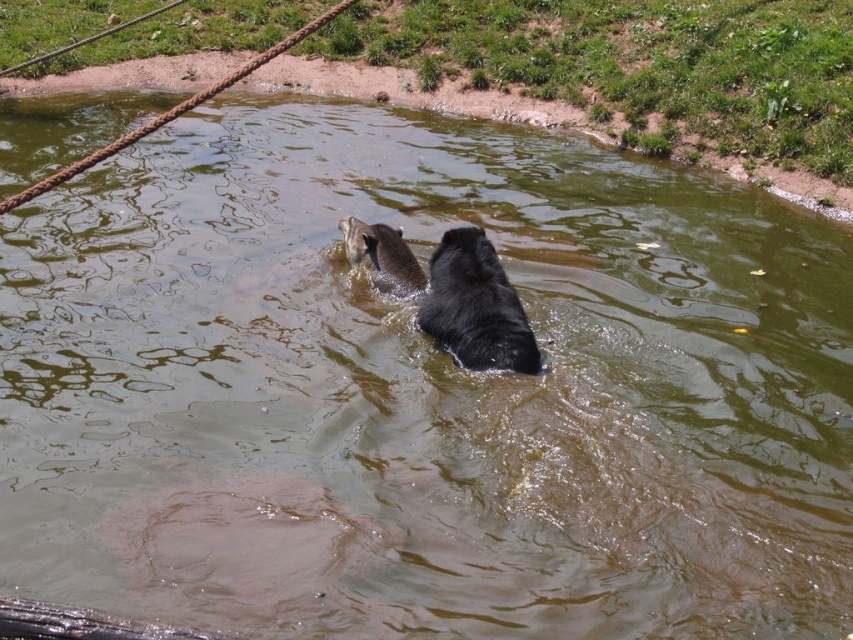
Question: Among these objects, which one is nearest to the camera?

Choices:
 (A) black fur dog at center
 (B) brown furry dog at upper center

Answer: (A)

Question: Which point is farther from the camera taking this photo?

Choices:
 (A) (480, 314)
 (B) (355, 236)

Answer: (B)

Question: Does black fur dog at center come in front of brown furry dog at upper center?

Choices:
 (A) yes
 (B) no

Answer: (A)

Question: Can you confirm if black fur dog at center is thinner than brown furry dog at upper center?

Choices:
 (A) yes
 (B) no

Answer: (B)

Question: Which of the following is the farthest from the observer?

Choices:
 (A) (469, 332)
 (B) (357, 234)

Answer: (B)

Question: Can you confirm if black fur dog at center is positioned to the left of brown furry dog at upper center?

Choices:
 (A) no
 (B) yes

Answer: (A)